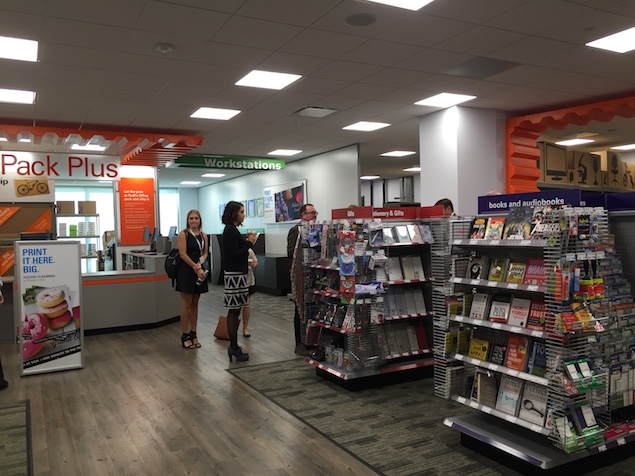
Image resolution: width=635 pixels, height=476 pixels. In order to click on wood floor in this screenshot , I will do click(x=204, y=416).